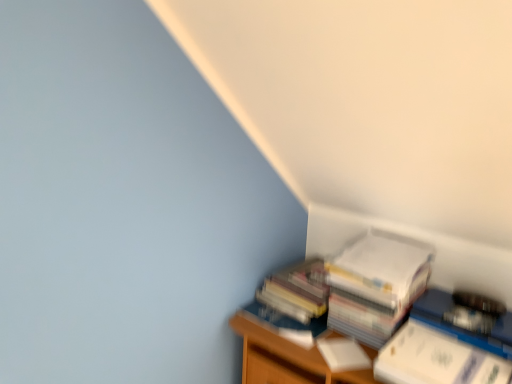
The width and height of the screenshot is (512, 384). Find the location of `white paper at right, the 3th paperback book in the back-to-front sequence`. white paper at right, the 3th paperback book in the back-to-front sequence is located at coordinates (436, 360).

Measure the distance between white matte paperback book at lower right, which is the 2th paperback book from back to front, and camera.

white matte paperback book at lower right, which is the 2th paperback book from back to front, and camera are 1.17 meters apart from each other.

This screenshot has height=384, width=512. I want to click on white paper at right, the 3th paperback book in the back-to-front sequence, so click(x=436, y=360).

Considering the positions of objects wooden bookshelf at lower right and white paper at upper right, acting as the first paperback book starting from the back, in the image provided, who is more to the right, wooden bookshelf at lower right or white paper at upper right, acting as the first paperback book starting from the back,?

Positioned to the right is white paper at upper right, acting as the first paperback book starting from the back.

Considering the relative sizes of wooden bookshelf at lower right and white paper at upper right, which is the 3th paperback book from front to back, in the image provided, is wooden bookshelf at lower right bigger than white paper at upper right, which is the 3th paperback book from front to back,?

Yes.

Is white paper at upper right, which is the 3th paperback book from front to back, a part of wooden bookshelf at lower right?

No, white paper at upper right, which is the 3th paperback book from front to back, is located outside of wooden bookshelf at lower right.

From the image's perspective, between wooden bookshelf at lower right and white paper at upper right, which is the 3th paperback book from front to back, which one is located above?

white paper at upper right, which is the 3th paperback book from front to back, appears higher in the image.

From a real-world perspective, starting from the white paper at upper right, acting as the first paperback book starting from the back, which paperback book is the 1st one below it? Please provide its 2D coordinates.

[(436, 360)]

Considering the positions of objects white paper at right, positioned as the first paperback book in front-to-back order, and white paper at upper right, acting as the first paperback book starting from the back, in the image provided, who is more to the right, white paper at right, positioned as the first paperback book in front-to-back order, or white paper at upper right, acting as the first paperback book starting from the back,?

white paper at right, positioned as the first paperback book in front-to-back order.

From a real-world perspective, who is located higher, white paper at right, positioned as the first paperback book in front-to-back order, or white paper at upper right, which is the 3th paperback book from front to back?

white paper at upper right, which is the 3th paperback book from front to back.

Which is nearer, [465,350] or [403,245]?

Point [465,350] is closer to the camera than point [403,245].

Visually, is white paper stack at lower right positioned to the left or to the right of white matte paperback book at lower right, which is the 2th paperback book from back to front?

In the image, white paper stack at lower right appears on the left side of white matte paperback book at lower right, which is the 2th paperback book from back to front.

Is white paper stack at lower right positioned with its back to white matte paperback book at lower right, which is the 2th paperback book from back to front?

That's not correct — white paper stack at lower right is not looking away from white matte paperback book at lower right, which is the 2th paperback book from back to front.

From a real-world perspective, is white paper stack at lower right beneath white matte paperback book at lower right, which is the 2th paperback book from back to front?

No, from a real-world perspective, white paper stack at lower right is not below white matte paperback book at lower right, which is the 2th paperback book from back to front.

Considering their positions, is white paper stack at lower right located in front of or behind white matte paperback book at lower right, placed as the second paperback book when sorted from front to back?

In the image, white paper stack at lower right appears behind white matte paperback book at lower right, placed as the second paperback book when sorted from front to back.

How many degrees apart are the facing directions of white paper stack at lower right and white paper at right, the 3th paperback book in the back-to-front sequence?

The facing directions of white paper stack at lower right and white paper at right, the 3th paperback book in the back-to-front sequence, are 0.633 degrees apart.

From a real-world perspective, is white paper stack at lower right located beneath white paper at right, positioned as the first paperback book in front-to-back order?

Actually, white paper stack at lower right is physically above white paper at right, positioned as the first paperback book in front-to-back order, in the real world.

Is white paper stack at lower right turned away from white paper at right, the 3th paperback book in the back-to-front sequence?

No, white paper stack at lower right is not facing away from white paper at right, the 3th paperback book in the back-to-front sequence.

Considering their positions, is white paper at right, positioned as the first paperback book in front-to-back order, located in front of or behind white paper stack at lower right?

white paper at right, positioned as the first paperback book in front-to-back order, is in front of white paper stack at lower right.

How different are the orientations of white paper at right, positioned as the first paperback book in front-to-back order, and white paper stack at lower right in degrees?

white paper at right, positioned as the first paperback book in front-to-back order, and white paper stack at lower right are facing 0.633 degrees away from each other.

Considering the sizes of objects white paper at right, the 3th paperback book in the back-to-front sequence, and white paper stack at lower right in the image provided, who is smaller, white paper at right, the 3th paperback book in the back-to-front sequence, or white paper stack at lower right?

white paper at right, the 3th paperback book in the back-to-front sequence.

Considering the positions of objects white matte paperback book at lower right, which is the 2th paperback book from back to front, and white paper stack at lower right in the image provided, who is more to the left, white matte paperback book at lower right, which is the 2th paperback book from back to front, or white paper stack at lower right?

white paper stack at lower right.

Relative to white paper stack at lower right, is white matte paperback book at lower right, which is the 2th paperback book from back to front, in front or behind?

white matte paperback book at lower right, which is the 2th paperback book from back to front, is in front of white paper stack at lower right.

Based on their sizes in the image, would you say white matte paperback book at lower right, placed as the second paperback book when sorted from front to back, is bigger or smaller than white paper stack at lower right?

white matte paperback book at lower right, placed as the second paperback book when sorted from front to back, is smaller than white paper stack at lower right.

Is white matte paperback book at lower right, which is the 2th paperback book from back to front, not within white paper at right, the 3th paperback book in the back-to-front sequence?

Yes, white matte paperback book at lower right, which is the 2th paperback book from back to front, is located beyond the bounds of white paper at right, the 3th paperback book in the back-to-front sequence.

Identify the location of paperback book in front of the white matte paperback book at lower right, placed as the second paperback book when sorted from front to back. (436, 360).

Looking at their sizes, would you say white matte paperback book at lower right, which is the 2th paperback book from back to front, is wider or thinner than white paper at right, the 3th paperback book in the back-to-front sequence?

Clearly, white matte paperback book at lower right, which is the 2th paperback book from back to front, has less width compared to white paper at right, the 3th paperback book in the back-to-front sequence.

Is white matte paperback book at lower right, placed as the second paperback book when sorted from front to back, facing towards white paper at right, positioned as the first paperback book in front-to-back order?

No, white matte paperback book at lower right, placed as the second paperback book when sorted from front to back, is not facing towards white paper at right, positioned as the first paperback book in front-to-back order.

From the wooden bookshelf at lower right, count 2nd paperback book to the right and point to it. Please provide its 2D coordinates.

[(376, 285)]

Identify the location of the 2nd paperback book below the white paper at upper right, which is the 3th paperback book from front to back (from the image's perspective). (436, 360).

Looking at this image, based on their spatial positions, is white paper at right, the 3th paperback book in the back-to-front sequence, or white paper at upper right, acting as the first paperback book starting from the back, further from wooden bookshelf at lower right?

white paper at upper right, acting as the first paperback book starting from the back, is further to wooden bookshelf at lower right.

From the image, which object appears to be farther from white paper stack at lower right, white paper at right, positioned as the first paperback book in front-to-back order, or white matte paperback book at lower right, which is the 2th paperback book from back to front?

white paper at right, positioned as the first paperback book in front-to-back order, is further to white paper stack at lower right.

Estimate the real-world distances between objects in this image. Which object is closer to wooden bookshelf at lower right, white matte paperback book at lower right, which is the 2th paperback book from back to front, or white paper stack at lower right?

The object closer to wooden bookshelf at lower right is white paper stack at lower right.

Considering their positions, is white paper at right, the 3th paperback book in the back-to-front sequence, positioned closer to wooden bookshelf at lower right than white paper stack at lower right?

white paper stack at lower right is closer to wooden bookshelf at lower right.

Considering their positions, is wooden bookshelf at lower right positioned closer to white paper at right, positioned as the first paperback book in front-to-back order, than white paper at upper right, acting as the first paperback book starting from the back?

white paper at upper right, acting as the first paperback book starting from the back, lies closer to white paper at right, positioned as the first paperback book in front-to-back order, than the other object.

Considering their positions, is white paper at upper right, which is the 3th paperback book from front to back, positioned further to white paper stack at lower right than wooden bookshelf at lower right?

white paper at upper right, which is the 3th paperback book from front to back, is further to white paper stack at lower right.

Which object lies further to the anchor point white paper at upper right, which is the 3th paperback book from front to back, wooden bookshelf at lower right or white matte paperback book at lower right, placed as the second paperback book when sorted from front to back?

wooden bookshelf at lower right.

Estimate the real-world distances between objects in this image. Which object is further from white paper at upper right, acting as the first paperback book starting from the back, white paper at right, positioned as the first paperback book in front-to-back order, or white matte paperback book at lower right, which is the 2th paperback book from back to front?

white matte paperback book at lower right, which is the 2th paperback book from back to front, is positioned further to the anchor white paper at upper right, acting as the first paperback book starting from the back.

Identify the location of furniture between white paper at right, the 3th paperback book in the back-to-front sequence, and white paper stack at lower right, along the z-axis. 283,353.

Identify the location of paperback book between white paper at right, positioned as the first paperback book in front-to-back order, and white paper at upper right, acting as the first paperback book starting from the back, along the z-axis. (343, 354).

Image resolution: width=512 pixels, height=384 pixels. I want to click on paperback book situated between white paper stack at lower right and white paper at upper right, acting as the first paperback book starting from the back, from left to right, so (x=343, y=354).